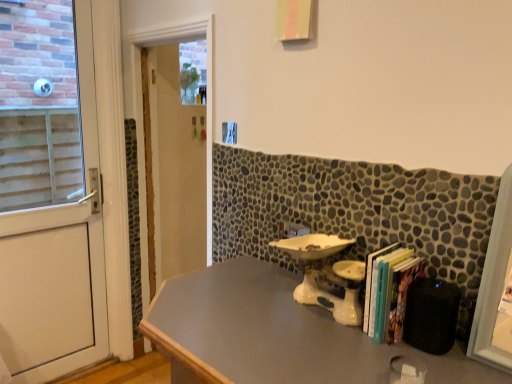
Question: Considering the positions of smooth gray table at center and white ceramic sink at center in the image, is smooth gray table at center bigger or smaller than white ceramic sink at center?

Choices:
 (A) small
 (B) big

Answer: (B)

Question: Does point (228, 264) appear closer or farther from the camera than point (300, 284)?

Choices:
 (A) farther
 (B) closer

Answer: (A)

Question: Which of these objects is positioned closest to the white ceramic sink at center?

Choices:
 (A) smooth gray table at center
 (B) hardcover books at right
 (C) white matte door at left
 (D) white glossy door at center

Answer: (B)

Question: Considering the real-world distances, which object is closest to the hardcover books at right?

Choices:
 (A) white ceramic sink at center
 (B) white matte door at left
 (C) smooth gray table at center
 (D) white glossy door at center

Answer: (A)